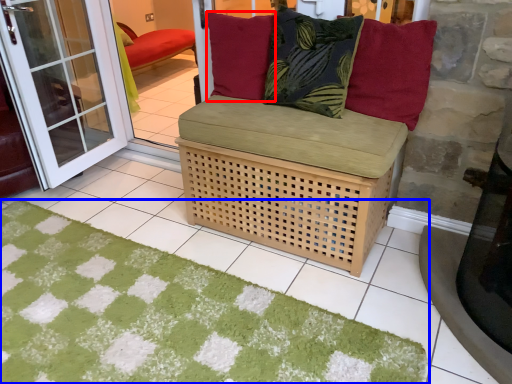
Question: Among these objects, which one is nearest to the camera, pillow (highlighted by a red box) or doormat (highlighted by a blue box)?

Choices:
 (A) pillow
 (B) doormat

Answer: (B)